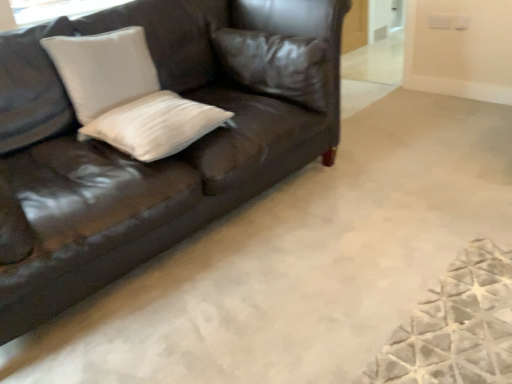
Question: Is shiny brown leather couch at upper left in contact with white matte pillow at center, the second pillow positioned from the right?

Choices:
 (A) no
 (B) yes

Answer: (A)

Question: Can white matte pillow at center, the second pillow positioned from the right, be found inside shiny brown leather couch at upper left?

Choices:
 (A) yes
 (B) no

Answer: (A)

Question: Is shiny brown leather couch at upper left further to camera compared to white matte pillow at center, the second pillow positioned from the right?

Choices:
 (A) yes
 (B) no

Answer: (B)

Question: Can you confirm if shiny brown leather couch at upper left is positioned to the right of white matte pillow at center, the second pillow positioned from the right?

Choices:
 (A) yes
 (B) no

Answer: (B)

Question: Is shiny brown leather couch at upper left turned away from white matte pillow at center, the second pillow positioned from the right?

Choices:
 (A) yes
 (B) no

Answer: (A)

Question: Visually, is shiny brown leather couch at upper left positioned to the left or to the right of leather pillow at upper center, which is the third pillow in left-to-right order?

Choices:
 (A) right
 (B) left

Answer: (B)

Question: From the image's perspective, is shiny brown leather couch at upper left located above or below leather pillow at upper center, which is the third pillow in left-to-right order?

Choices:
 (A) above
 (B) below

Answer: (B)

Question: Choose the correct answer: Is shiny brown leather couch at upper left inside leather pillow at upper center, which is the first pillow from right to left, or outside it?

Choices:
 (A) outside
 (B) inside

Answer: (A)

Question: Considering the positions of shiny brown leather couch at upper left and leather pillow at upper center, which is the first pillow from right to left, in the image, is shiny brown leather couch at upper left wider or thinner than leather pillow at upper center, which is the first pillow from right to left,?

Choices:
 (A) thin
 (B) wide

Answer: (B)

Question: Is leather pillow at upper center, which is the first pillow from right to left, bigger or smaller than white matte pillow at center, arranged as the 2th pillow when viewed from the left?

Choices:
 (A) small
 (B) big

Answer: (B)

Question: Is leather pillow at upper center, which is the third pillow in left-to-right order, in front of or behind white matte pillow at center, arranged as the 2th pillow when viewed from the left, in the image?

Choices:
 (A) behind
 (B) front

Answer: (A)

Question: From their relative heights in the image, would you say leather pillow at upper center, which is the third pillow in left-to-right order, is taller or shorter than white matte pillow at center, arranged as the 2th pillow when viewed from the left?

Choices:
 (A) tall
 (B) short

Answer: (A)

Question: Is point (321, 97) positioned closer to the camera than point (138, 130)?

Choices:
 (A) closer
 (B) farther

Answer: (B)

Question: In the image, is white matte pillow at center, the second pillow positioned from the right, positioned in front of or behind white matte pillow at upper left, which is counted as the 1th pillow, starting from the left?

Choices:
 (A) front
 (B) behind

Answer: (A)

Question: Do you think white matte pillow at center, the second pillow positioned from the right, is within white matte pillow at upper left, which is counted as the 1th pillow, starting from the left, or outside of it?

Choices:
 (A) outside
 (B) inside

Answer: (A)